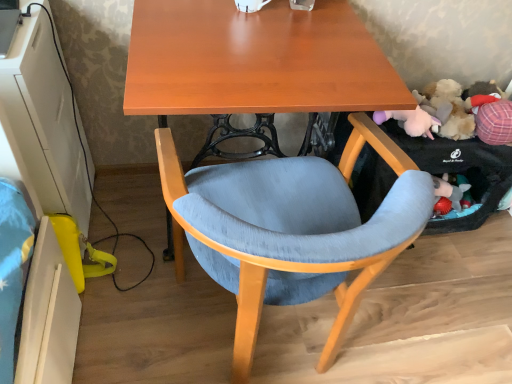
Image resolution: width=512 pixels, height=384 pixels. I want to click on vacant space situated on the left part of textured fabric chair at center, so click(128, 283).